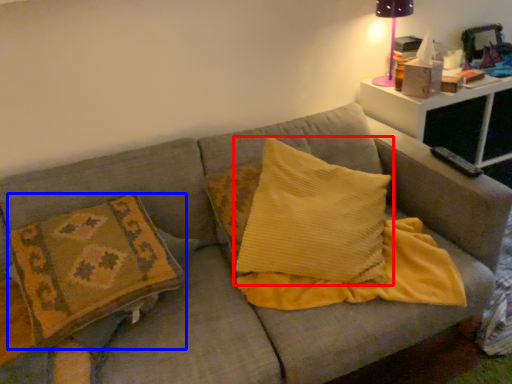
Question: Which of the following is the farthest to the observer, pillow (highlighted by a red box) or pillow (highlighted by a blue box)?

Choices:
 (A) pillow
 (B) pillow

Answer: (A)